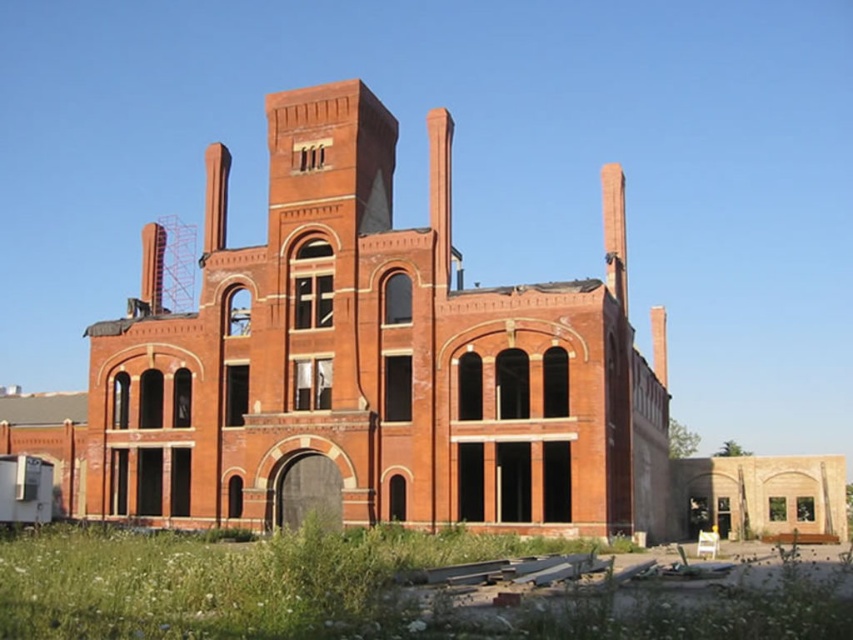
You are a photographer planning to take a wide shot of the red brick building at center and the green grass at lower left. Based on their sizes, which one should you focus on to ensure both are in frame without cropping?

The red brick building at center is larger than the green grass at lower left, so you should focus on the red brick building at center to ensure both fit in the frame without cropping.

Based on the photo, you are standing at the front of the abandoned red brick building. There are two points marked on the ground in front of you. The first point is at coordinates point (x=368, y=403) and the second is at point (x=527, y=632). Which point is closer to the building?

Point (x=368, y=403) is behind point (x=527, y=632), so the point closer to the building is point (x=527, y=632).